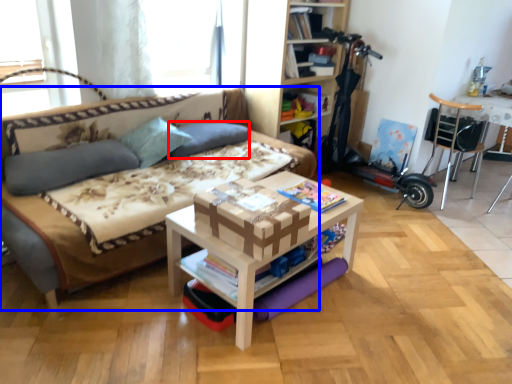
Question: Which object is closer to the camera taking this photo, pillow (highlighted by a red box) or studio couch (highlighted by a blue box)?

Choices:
 (A) pillow
 (B) studio couch

Answer: (B)